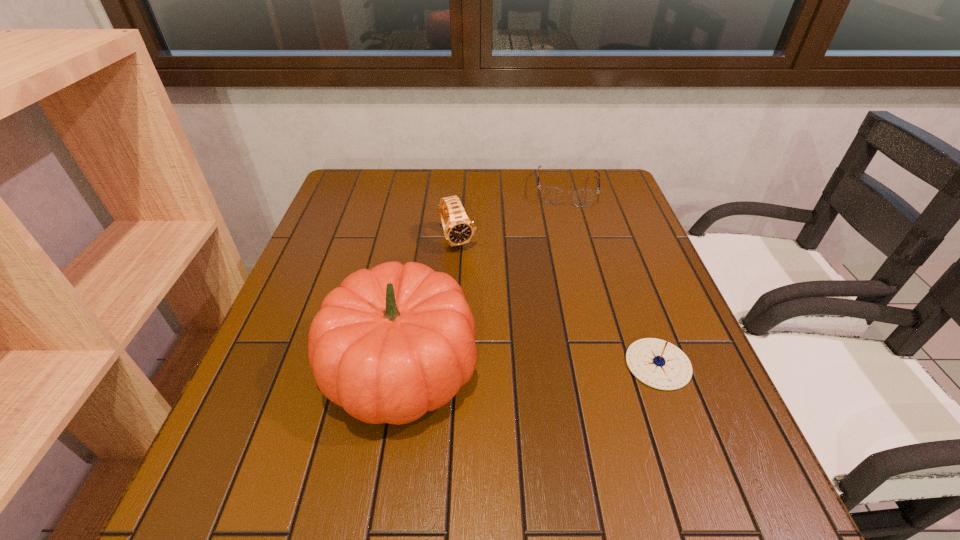
Locate an element on the screen. Image resolution: width=960 pixels, height=540 pixels. the tallest object is located at coordinates (391, 343).

Locate an element on the screen. This screenshot has height=540, width=960. compass is located at coordinates (657, 363).

The width and height of the screenshot is (960, 540). I want to click on the third shortest object, so click(x=458, y=229).

Locate an element on the screen. the second farthest object is located at coordinates (458, 229).

Find the location of `spectacles`. spectacles is located at coordinates (551, 195).

This screenshot has height=540, width=960. Find the location of `free location located on the left of the pumpkin`. free location located on the left of the pumpkin is located at coordinates (280, 368).

You are a GUI agent. You are given a task and a screenshot of the screen. Output one action in this format:
    pyautogui.click(x=<x>, y=<y>)
    Task: Click on the vacant space located 0.320m on the back of the compass
    
    Given the screenshot: What is the action you would take?
    pyautogui.click(x=614, y=246)

Where is `vacant space located on the face of the watch`? The height and width of the screenshot is (540, 960). vacant space located on the face of the watch is located at coordinates (501, 327).

In order to click on vacant space situated 0.160m on the face of the watch in this screenshot , I will do `click(485, 296)`.

This screenshot has width=960, height=540. Find the location of `vacant space positioned 0.100m on the face of the watch`. vacant space positioned 0.100m on the face of the watch is located at coordinates (476, 280).